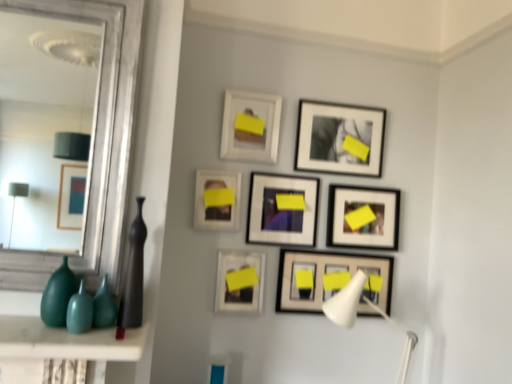
This screenshot has width=512, height=384. Describe the element at coordinates (346, 301) in the screenshot. I see `white plastic table lamp at lower right` at that location.

What do you see at coordinates (250, 126) in the screenshot? The image size is (512, 384). I see `matte white picture frame at upper center, the 1th picture frame positioned from the top` at bounding box center [250, 126].

Locate an element on the screen. This screenshot has height=384, width=512. matte black picture frame at center, which is counted as the seventh picture frame, starting from the top is located at coordinates (335, 279).

Locate an element on the screen. The image size is (512, 384). matte black picture frame at center, marked as the 5th picture frame in a bottom-to-top arrangement is located at coordinates [282, 210].

At what (x,y) coordinates should I click in order to perform the action: click on matte black picture frame at upper center, marked as the 7th picture frame in a bottom-to-top arrangement. Please return your answer as a coordinate pair (x, y). The image size is (512, 384). Looking at the image, I should click on (339, 139).

Which object is closer to the camera taking this photo, matte black vase at left, which is the 2th vase from left to right, or matte black picture frame at upper center, placed as the second picture frame when sorted from top to bottom?

matte black vase at left, which is the 2th vase from left to right.

Does matte black vase at left, which is the 2th vase from left to right, have a lesser height compared to matte black picture frame at upper center, marked as the 7th picture frame in a bottom-to-top arrangement?

In fact, matte black vase at left, which is the 2th vase from left to right, may be taller than matte black picture frame at upper center, marked as the 7th picture frame in a bottom-to-top arrangement.

From the image's perspective, which one is positioned higher, matte black vase at left, the 1th vase when ordered from back to front, or matte black picture frame at upper center, placed as the second picture frame when sorted from top to bottom?

matte black picture frame at upper center, placed as the second picture frame when sorted from top to bottom, appears higher in the image.

Is matte black vase at left, which is the 2th vase from left to right, looking in the opposite direction of matte black picture frame at upper center, placed as the second picture frame when sorted from top to bottom?

No, matte black picture frame at upper center, placed as the second picture frame when sorted from top to bottom, is not at the back of matte black vase at left, which is the 2th vase from left to right.

Would you say matte black picture frame at upper center, placed as the second picture frame when sorted from top to bottom, is inside or outside matte white picture frame at upper center, which is counted as the eighth picture frame, starting from the bottom?

matte black picture frame at upper center, placed as the second picture frame when sorted from top to bottom, is located beyond the bounds of matte white picture frame at upper center, which is counted as the eighth picture frame, starting from the bottom.

In the scene shown: From a real-world perspective, which object stands above the other?

matte white picture frame at upper center, which is counted as the eighth picture frame, starting from the bottom.

In the image, is matte black picture frame at upper center, marked as the 7th picture frame in a bottom-to-top arrangement, on the left side or the right side of matte white picture frame at upper center, which is counted as the eighth picture frame, starting from the bottom?

From the image, it's evident that matte black picture frame at upper center, marked as the 7th picture frame in a bottom-to-top arrangement, is to the right of matte white picture frame at upper center, which is counted as the eighth picture frame, starting from the bottom.

What's the angular difference between matte white picture frame at center-left, the 6th picture frame from the bottom, and matte white picture frame at center, which is counted as the 6th picture frame, starting from the top,'s facing directions?

matte white picture frame at center-left, the 6th picture frame from the bottom, and matte white picture frame at center, which is counted as the 6th picture frame, starting from the top, are facing 1.19 degrees away from each other.

In terms of width, does matte white picture frame at center-left, the 6th picture frame from the bottom, look wider or thinner when compared to matte white picture frame at center, marked as the third picture frame in a bottom-to-top arrangement?

Clearly, matte white picture frame at center-left, the 6th picture frame from the bottom, has less width compared to matte white picture frame at center, marked as the third picture frame in a bottom-to-top arrangement.

From the picture: Who is bigger, matte white picture frame at center-left, the 3th picture frame positioned from the top, or matte white picture frame at center, marked as the third picture frame in a bottom-to-top arrangement?

matte white picture frame at center, marked as the third picture frame in a bottom-to-top arrangement.

Between point (234, 225) and point (222, 267), which one is positioned behind?

Point (234, 225)

Considering the positions of points (338, 242) and (324, 281), is point (338, 242) closer to camera compared to point (324, 281)?

No, it is behind (324, 281).

Based on the photo, who is taller, matte black picture frame at center right, the 4th picture frame when ordered from bottom to top, or matte black picture frame at center, the 2th picture frame from the bottom?

matte black picture frame at center right, the 4th picture frame when ordered from bottom to top, is taller.

Does matte black picture frame at center right, the 4th picture frame when ordered from bottom to top, turn towards matte black picture frame at center, which is counted as the seventh picture frame, starting from the top?

No.

You are a GUI agent. You are given a task and a screenshot of the screen. Output one action in this format:
    pyautogui.click(x=<x>, y=<y>)
    Task: Click on the 2nd picture frame counting from the left of the matte black picture frame at center right, which is counted as the 5th picture frame, starting from the top
    This screenshot has width=512, height=384.
    Given the screenshot: What is the action you would take?
    pyautogui.click(x=335, y=279)

Which of these two, matte black picture frame at upper center, marked as the 7th picture frame in a bottom-to-top arrangement, or teal glass vase at lower left, which is counted as the second glass vase, starting from the right, is thinner?

matte black picture frame at upper center, marked as the 7th picture frame in a bottom-to-top arrangement.

In the image, is matte black picture frame at upper center, marked as the 7th picture frame in a bottom-to-top arrangement, positioned in front of or behind teal glass vase at lower left, which is counted as the second glass vase, starting from the right?

matte black picture frame at upper center, marked as the 7th picture frame in a bottom-to-top arrangement, is positioned farther from the viewer than teal glass vase at lower left, which is counted as the second glass vase, starting from the right.

Which is behind, point (318, 104) or point (68, 294)?

Point (318, 104)

Is matte black picture frame at upper center, placed as the second picture frame when sorted from top to bottom, positioned with its back to teal glass vase at lower left, which is counted as the second glass vase, starting from the right?

matte black picture frame at upper center, placed as the second picture frame when sorted from top to bottom, is not turned away from teal glass vase at lower left, which is counted as the second glass vase, starting from the right.

Consider the image. Could you measure the distance between matte black picture frame at center right, which is counted as the 5th picture frame, starting from the top, and matte white picture frame at upper center, the 1th picture frame positioned from the top?

matte black picture frame at center right, which is counted as the 5th picture frame, starting from the top, and matte white picture frame at upper center, the 1th picture frame positioned from the top, are 18.65 inches apart.

Is matte black picture frame at center right, the 4th picture frame when ordered from bottom to top, positioned far away from matte white picture frame at upper center, which is counted as the eighth picture frame, starting from the bottom?

matte black picture frame at center right, the 4th picture frame when ordered from bottom to top, is actually quite close to matte white picture frame at upper center, which is counted as the eighth picture frame, starting from the bottom.

Considering the relative sizes of matte black picture frame at center right, the 4th picture frame when ordered from bottom to top, and matte white picture frame at upper center, the 1th picture frame positioned from the top, in the image provided, is matte black picture frame at center right, the 4th picture frame when ordered from bottom to top, bigger than matte white picture frame at upper center, the 1th picture frame positioned from the top,?

Indeed, matte black picture frame at center right, the 4th picture frame when ordered from bottom to top, has a larger size compared to matte white picture frame at upper center, the 1th picture frame positioned from the top.

From the image's perspective, which is above, matte black picture frame at center right, the 4th picture frame when ordered from bottom to top, or matte white picture frame at upper center, the 1th picture frame positioned from the top?

matte white picture frame at upper center, the 1th picture frame positioned from the top, appears higher in the image.

The height and width of the screenshot is (384, 512). I want to click on the 4th picture frame located above the matte white picture frame at center, which is counted as the 6th picture frame, starting from the top (from a real-world perspective), so click(282, 210).

Choose the correct answer: Is matte white picture frame at center, marked as the third picture frame in a bottom-to-top arrangement, inside matte black picture frame at center, which is the fourth picture frame from top to bottom, or outside it?

matte white picture frame at center, marked as the third picture frame in a bottom-to-top arrangement, exists outside the volume of matte black picture frame at center, which is the fourth picture frame from top to bottom.

In terms of height, does matte white picture frame at center, marked as the third picture frame in a bottom-to-top arrangement, look taller or shorter compared to matte black picture frame at center, which is the fourth picture frame from top to bottom?

Considering their sizes, matte white picture frame at center, marked as the third picture frame in a bottom-to-top arrangement, has less height than matte black picture frame at center, which is the fourth picture frame from top to bottom.

Starting from the matte black vase at left, the 2th vase viewed from the front, which picture frame is the 7th one to the right? Please provide its 2D coordinates.

[(339, 139)]

From the image's perspective, starting from the matte white picture frame at upper center, which is counted as the eighth picture frame, starting from the bottom, which picture frame is the 1st one below? Please provide its 2D coordinates.

[(339, 139)]

When comparing their distances from matte black picture frame at center, marked as the 5th picture frame in a bottom-to-top arrangement, does matte black picture frame at lower center, which is the first picture frame from bottom to top, or matte black vase at left, the 1th vase when ordered from back to front, seem further?

matte black vase at left, the 1th vase when ordered from back to front.

Which object lies nearer to the anchor point matte black picture frame at center right, the 4th picture frame when ordered from bottom to top, matte black picture frame at lower center, which is the first picture frame from bottom to top, or white plastic table lamp at lower right?

Among the two, matte black picture frame at lower center, which is the first picture frame from bottom to top, is located nearer to matte black picture frame at center right, the 4th picture frame when ordered from bottom to top.

Which object lies further to the anchor point matte black picture frame at center, marked as the 5th picture frame in a bottom-to-top arrangement, teal glossy vase at lower left, the first vase positioned from the front, or matte black vase at left, the 1th vase from the right?

teal glossy vase at lower left, the first vase positioned from the front, is further to matte black picture frame at center, marked as the 5th picture frame in a bottom-to-top arrangement.

When comparing their distances from matte black picture frame at center, the 2th picture frame from the bottom, does matte black picture frame at center right, the 4th picture frame when ordered from bottom to top, or teal glossy vase at lower left, the second vase when ordered from back to front, seem closer?

matte black picture frame at center right, the 4th picture frame when ordered from bottom to top, is closer to matte black picture frame at center, the 2th picture frame from the bottom.

Considering their positions, is matte black picture frame at upper center, marked as the 7th picture frame in a bottom-to-top arrangement, positioned closer to teal glossy vase at lower left, the first vase positioned from the front, than matte black picture frame at lower center, which is the eighth picture frame in top-to-bottom order?

Among the two, matte black picture frame at lower center, which is the eighth picture frame in top-to-bottom order, is located nearer to teal glossy vase at lower left, the first vase positioned from the front.

Estimate the real-world distances between objects in this image. Which object is further from matte white picture frame at center, marked as the third picture frame in a bottom-to-top arrangement, white plastic table lamp at lower right or matte white picture frame at center-left, the 6th picture frame from the bottom?

Based on the image, white plastic table lamp at lower right appears to be further to matte white picture frame at center, marked as the third picture frame in a bottom-to-top arrangement.

Considering their positions, is teal glossy vase at lower left, which is counted as the 1th vase, starting from the left, positioned closer to green glass vase at lower left, the first glass vase when ordered from right to left, than matte white picture frame at center-left, the 3th picture frame positioned from the top?

teal glossy vase at lower left, which is counted as the 1th vase, starting from the left, is closer to green glass vase at lower left, the first glass vase when ordered from right to left.

Considering their positions, is matte white picture frame at center, which is counted as the 6th picture frame, starting from the top, positioned closer to matte white picture frame at upper center, which is counted as the eighth picture frame, starting from the bottom, than green glass vase at lower left, the first glass vase when ordered from right to left?

matte white picture frame at center, which is counted as the 6th picture frame, starting from the top, is positioned closer to the anchor matte white picture frame at upper center, which is counted as the eighth picture frame, starting from the bottom.

Identify the location of vase between teal glass vase at lower left, which is counted as the second glass vase, starting from the right, and matte black picture frame at center, marked as the 5th picture frame in a bottom-to-top arrangement, from front to back. This screenshot has height=384, width=512. (133, 276).

Where is `glass vase between teal glass vase at lower left, which ranks as the 1th glass vase in left-to-right order, and matte black vase at left, the 1th vase from the right, in the horizontal direction`? This screenshot has height=384, width=512. glass vase between teal glass vase at lower left, which ranks as the 1th glass vase in left-to-right order, and matte black vase at left, the 1th vase from the right, in the horizontal direction is located at coordinates (103, 307).

The image size is (512, 384). Find the location of `vase located between teal glass vase at lower left, which ranks as the 1th glass vase in left-to-right order, and matte white picture frame at center-left, the 3th picture frame positioned from the top, in the depth direction`. vase located between teal glass vase at lower left, which ranks as the 1th glass vase in left-to-right order, and matte white picture frame at center-left, the 3th picture frame positioned from the top, in the depth direction is located at coordinates (133, 276).

What are the coordinates of `vase between teal glossy vase at lower left, the first vase positioned from the front, and matte white picture frame at upper center, the 1th picture frame positioned from the top, from front to back` in the screenshot? It's located at (133, 276).